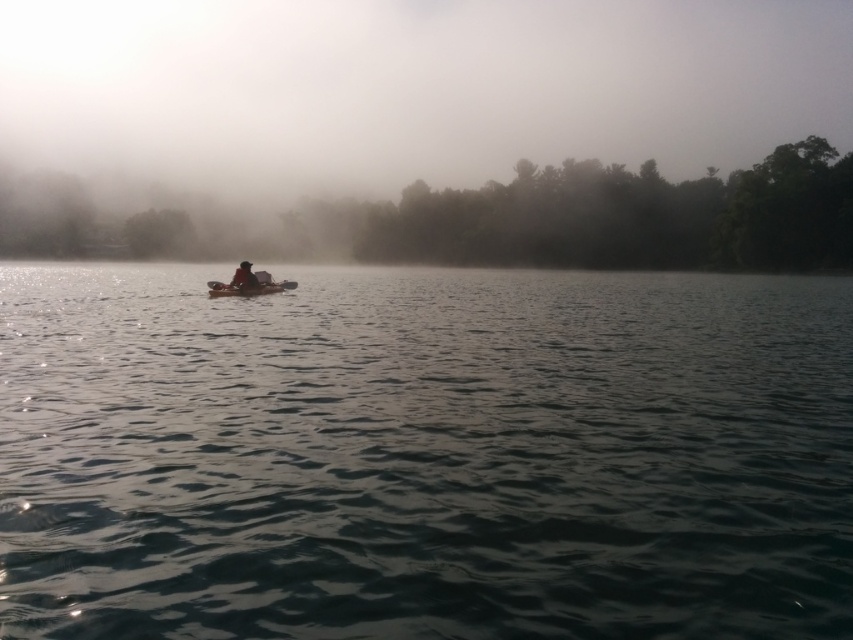
Question: From the image, what is the correct spatial relationship of matte black kayak at center in relation to black plastic paddle at center?

Choices:
 (A) left
 (B) right

Answer: (A)

Question: Can you confirm if matte black kayak at center is positioned to the left of black plastic paddle at center?

Choices:
 (A) no
 (B) yes

Answer: (B)

Question: Which object appears farthest from the camera in this image?

Choices:
 (A) smooth brown canoe at center
 (B) black plastic paddle at center
 (C) clear water at center

Answer: (B)

Question: Where is clear water at center located in relation to smooth brown canoe at center in the image?

Choices:
 (A) above
 (B) below

Answer: (B)

Question: Among these points, which one is nearest to the camera?

Choices:
 (A) click(x=289, y=284)
 (B) click(x=469, y=417)
 (C) click(x=259, y=285)

Answer: (B)

Question: Based on their relative distances, which object is nearer to the matte black kayak at center?

Choices:
 (A) smooth brown canoe at center
 (B) clear water at center
 (C) black plastic paddle at center

Answer: (A)